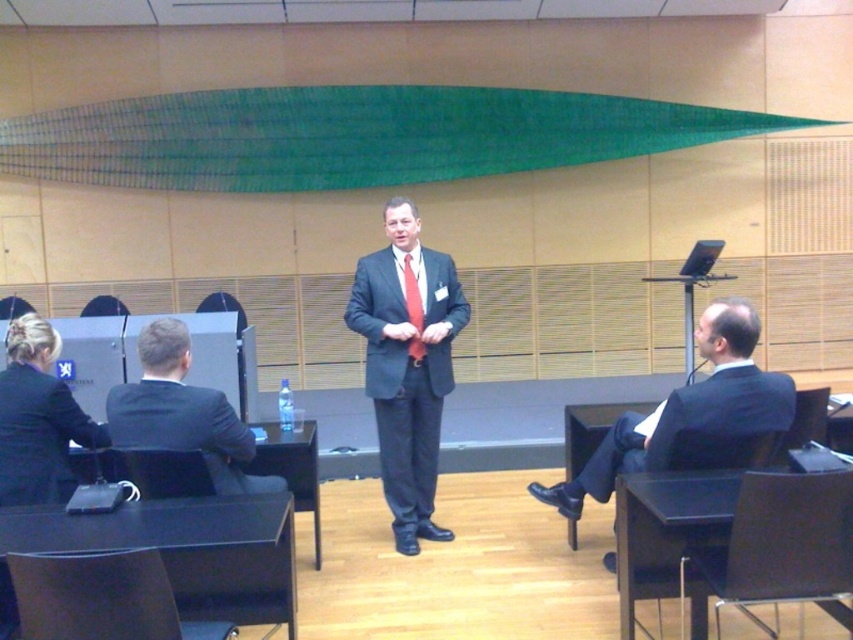
You are an event planner organizing a meeting in this room. You need to ensure that the black plastic chair at lower right and the red silk tie at center are visible to all attendees. Considering their sizes, which object might require strategic placement to ensure visibility?

The black plastic chair at lower right is larger than the red silk tie at center, so the red silk tie at center might need to be placed in a more prominent position to ensure visibility.

You are an event planner setting up a stage for a presentation. The stage currently has a matte black suit at center and a black plastic chair at lower right. To ensure the speaker is visible to all attendees, which object should be placed higher?

The matte black suit at center should be placed higher since it is taller than the black plastic chair at lower right, ensuring the speaker remains visible over the chair.

You are a photographer positioned near the camera in the scene. The speaker in the matte black suit at center is about to start a speech. To ensure a clear shot, you need to know the distance between the camera and the speaker. Can you confirm if the distance is sufficient for a good quality photograph?

The matte black suit at center and camera are 3.97 meters apart. This distance is sufficient for a good quality photograph as most professional cameras can capture clear images at this range.